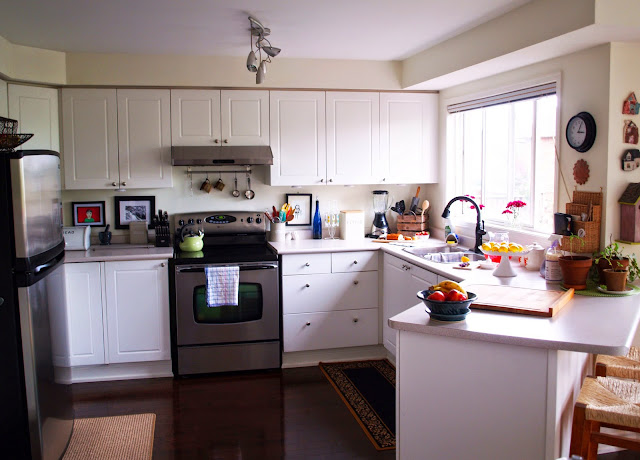
Image resolution: width=640 pixels, height=460 pixels. Identify the location of wood counter. (589, 315).